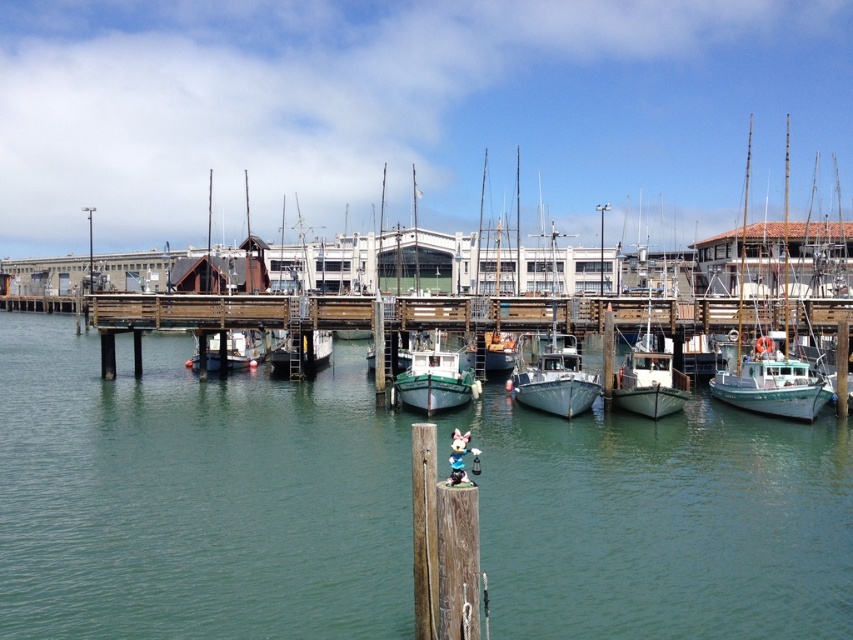
Question: Observing the image, what is the correct spatial positioning of teal matte boat at right in reference to white wooden boat at center?

Choices:
 (A) below
 (B) above

Answer: (B)

Question: Does wooden dock at center have a smaller size compared to teal matte boat at right?

Choices:
 (A) yes
 (B) no

Answer: (A)

Question: Which of the following is the closest to the observer?

Choices:
 (A) green matte boat at center
 (B) white wooden boat at center
 (C) green water at center
 (D) teal matte boat at right

Answer: (C)

Question: Is wooden dock at center positioned in front of green matte boat at center?

Choices:
 (A) yes
 (B) no

Answer: (B)

Question: Which of these objects is positioned farthest from the green matte boat at center?

Choices:
 (A) green water at center
 (B) teal matte boat at right
 (C) white wooden boat at center

Answer: (B)

Question: Which object is closer to the camera taking this photo?

Choices:
 (A) teal matte boat at right
 (B) wooden dock at center
 (C) green matte boat at center

Answer: (A)